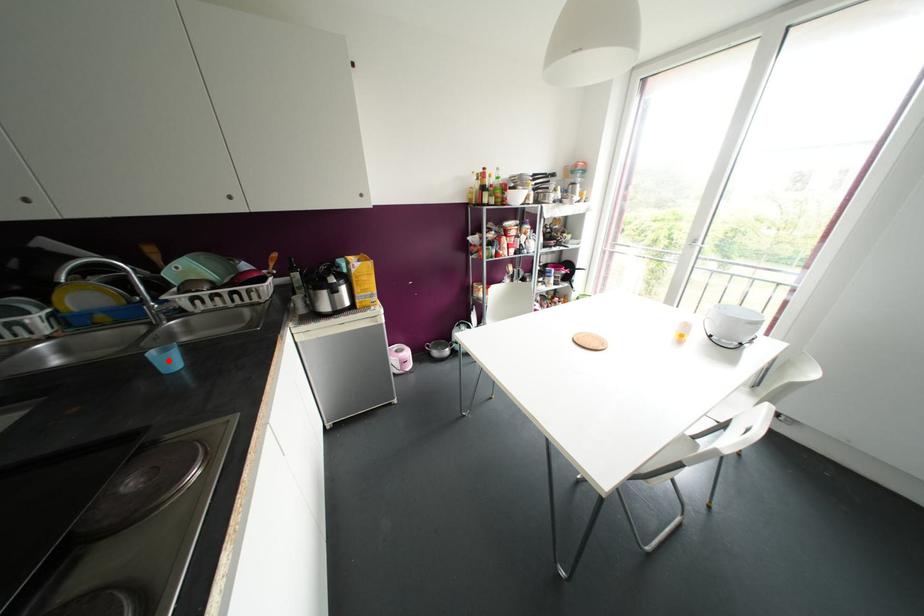
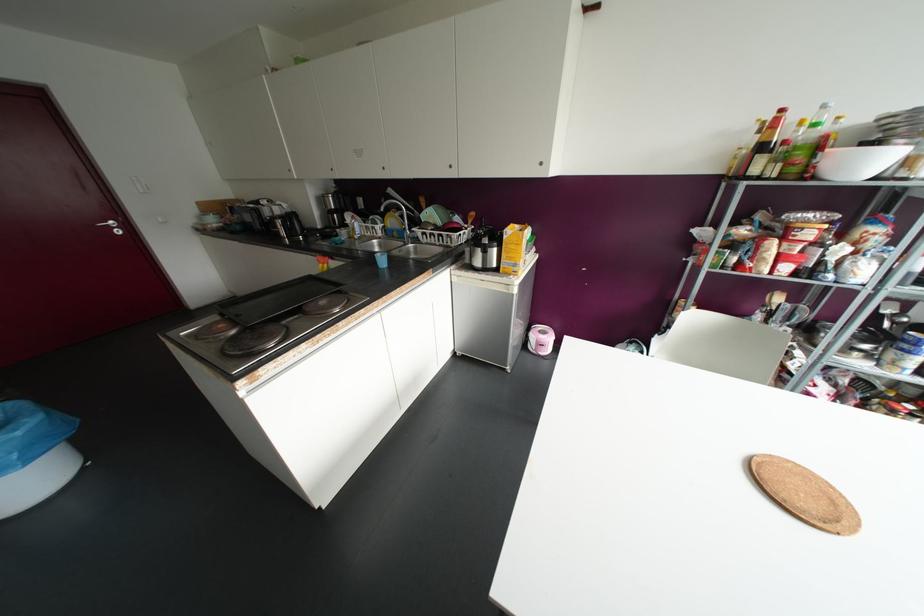
Question: I am providing you with two images of the same scene from different viewpoints. A red point is marked on the first image. At the location where the point appears in image 1, is it still visible in image 2?

Choices:
 (A) Yes
 (B) No

Answer: (A)